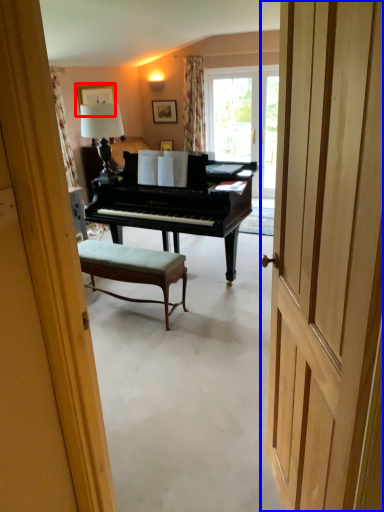
Question: Which object appears farthest to the camera in this image, picture frame (highlighted by a red box) or door (highlighted by a blue box)?

Choices:
 (A) picture frame
 (B) door

Answer: (A)